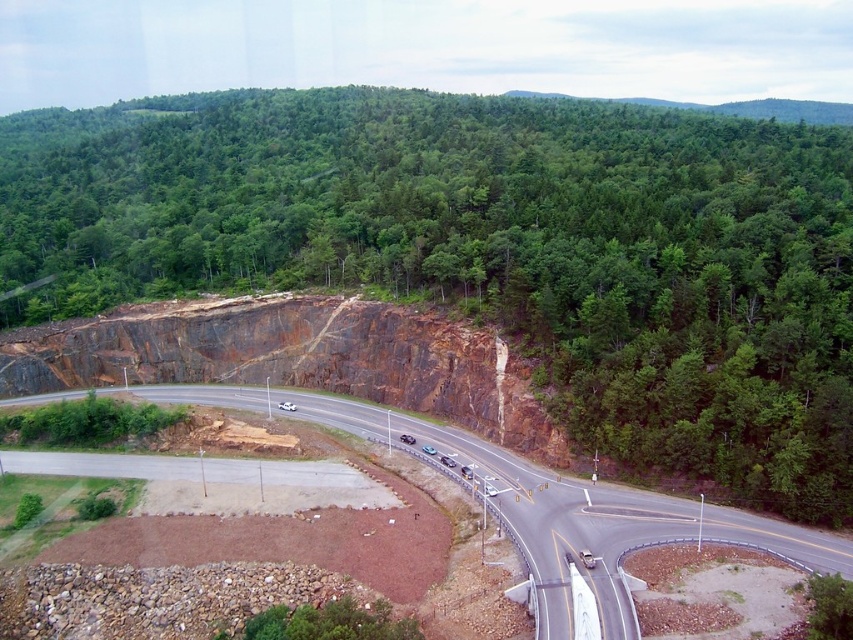
Is green leafy tree at center further to camera compared to asphalt road at center?

Yes, it is.

Between green leafy tree at center and asphalt road at center, which one has more height?

green leafy tree at center

Identify the location of green leafy tree at center. (494, 248).